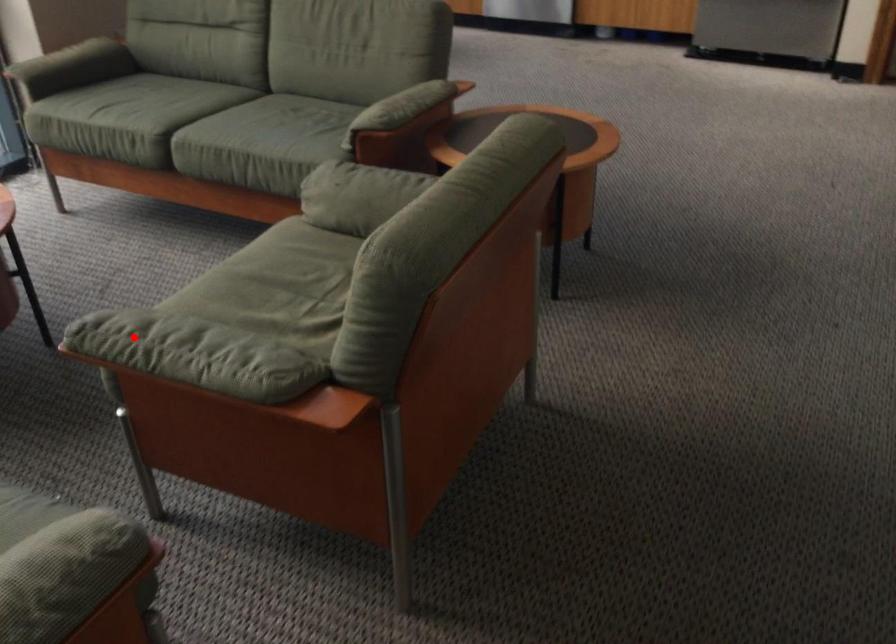
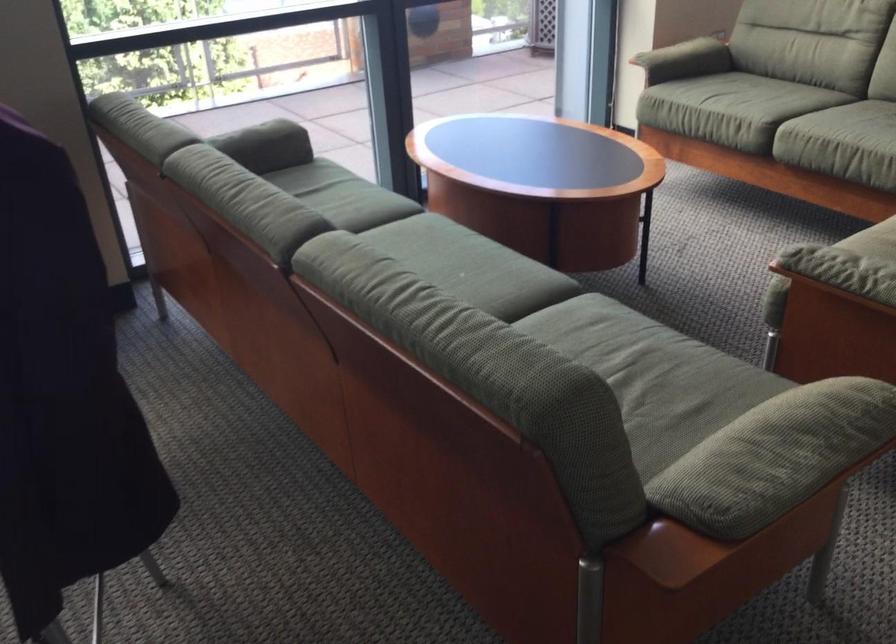
Question: I am providing you with two images of the same scene from different viewpoints. In image1, a red point is highlighted. Considering the same 3D point in image2, which of the following is correct?

Choices:
 (A) It is closer
 (B) It is farther

Answer: (B)